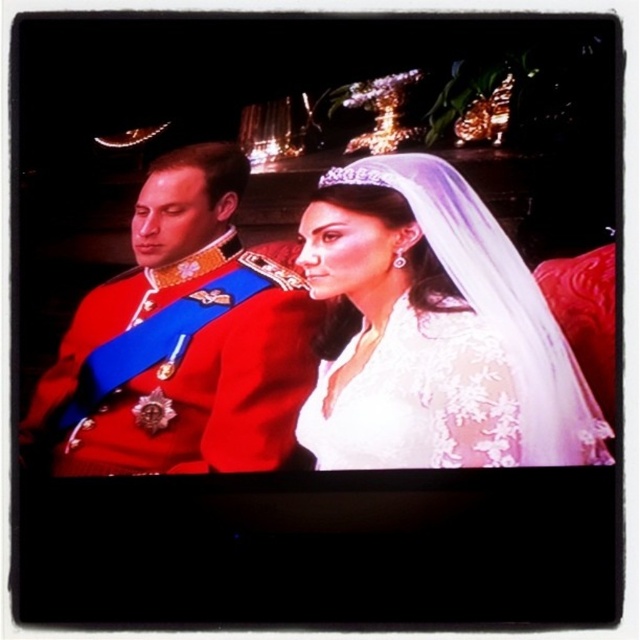
How much distance is there between white lace veil at upper center and shiny red uniform at left?

They are 4.63 feet apart.

Does white lace veil at upper center appear on the right side of shiny red uniform at left?

Correct, you'll find white lace veil at upper center to the right of shiny red uniform at left.

Is point (380, 406) behind point (160, 285)?

No, it is not.

Where is `white lace veil at upper center`? This screenshot has width=640, height=640. white lace veil at upper center is located at coordinates (436, 333).

Measure the distance between point (380, 364) and camera.

Point (380, 364) and camera are 10.80 meters apart from each other.

Can you confirm if white lace veil at upper center is shorter than clear crystal tiara at upper center?

No.

Who is more forward, [525,269] or [369,173]?

Point [525,269]

In order to click on white lace veil at upper center in this screenshot , I will do `click(436, 333)`.

Can you confirm if white lace veil at upper center is smaller than white lace dress at center?

No, white lace veil at upper center is not smaller than white lace dress at center.

Does white lace veil at upper center come behind white lace dress at center?

Yes, white lace veil at upper center is behind white lace dress at center.

The width and height of the screenshot is (640, 640). What do you see at coordinates (436, 333) in the screenshot?
I see `white lace veil at upper center` at bounding box center [436, 333].

Image resolution: width=640 pixels, height=640 pixels. Identify the location of white lace veil at upper center. (436, 333).